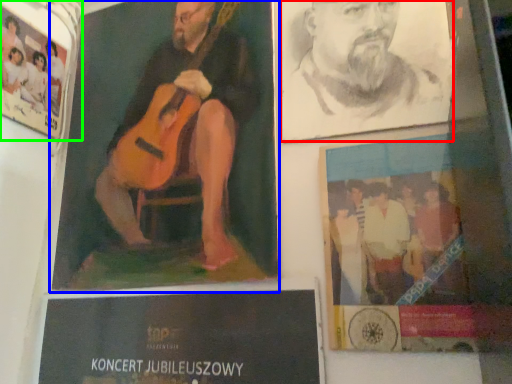
Question: Based on their relative distances, which object is nearer to man (highlighted by a red box)? Choose from poster (highlighted by a blue box) and poster (highlighted by a green box).

Choices:
 (A) poster
 (B) poster

Answer: (A)